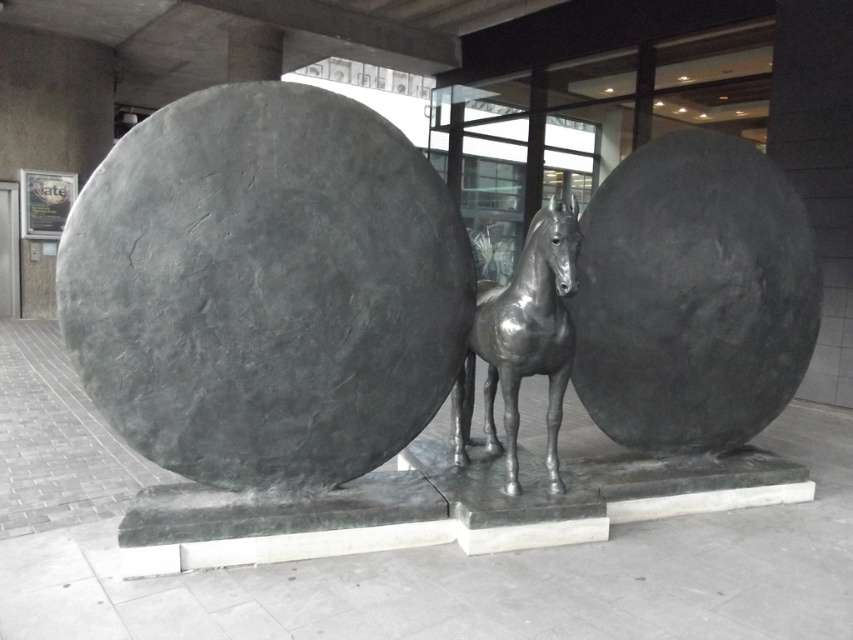
Question: Does bronze horse at center appear under polished bronze horse at center?

Choices:
 (A) no
 (B) yes

Answer: (A)

Question: Can you confirm if bronze horse at center is positioned below polished bronze horse at center?

Choices:
 (A) no
 (B) yes

Answer: (A)

Question: Is the position of bronze horse at center more distant than that of polished bronze horse at center?

Choices:
 (A) yes
 (B) no

Answer: (B)

Question: Which of the following is the closest to the observer?

Choices:
 (A) (514, 385)
 (B) (204, 115)

Answer: (B)